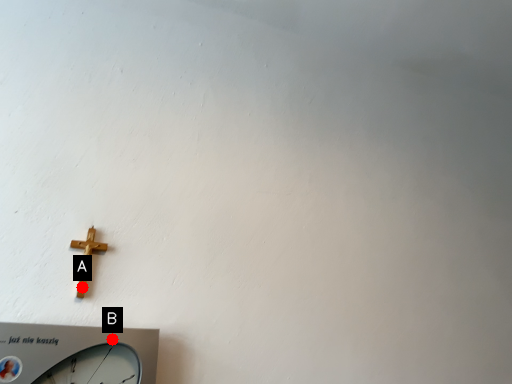
Question: Two points are circled on the image, labeled by A and B beside each circle. Which of the following is the closest to the observer?

Choices:
 (A) A is closer
 (B) B is closer

Answer: (B)